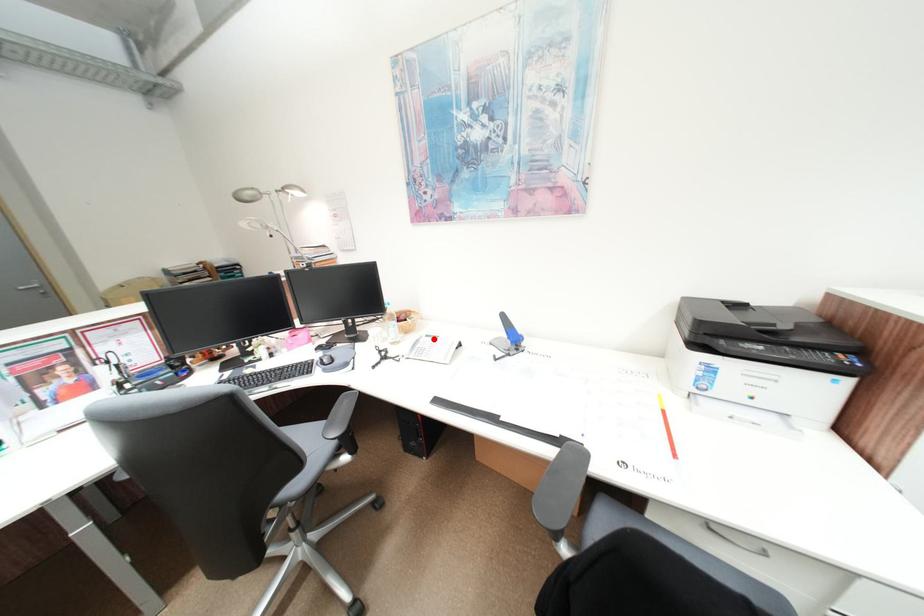
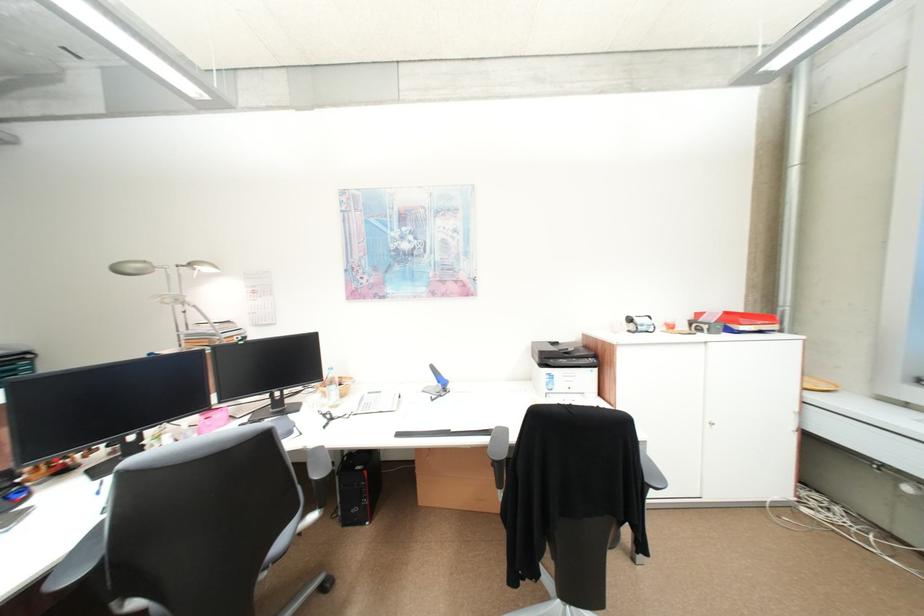
Locate, in the second image, the point that corresponds to the highlighted location in the first image.

(377, 397)